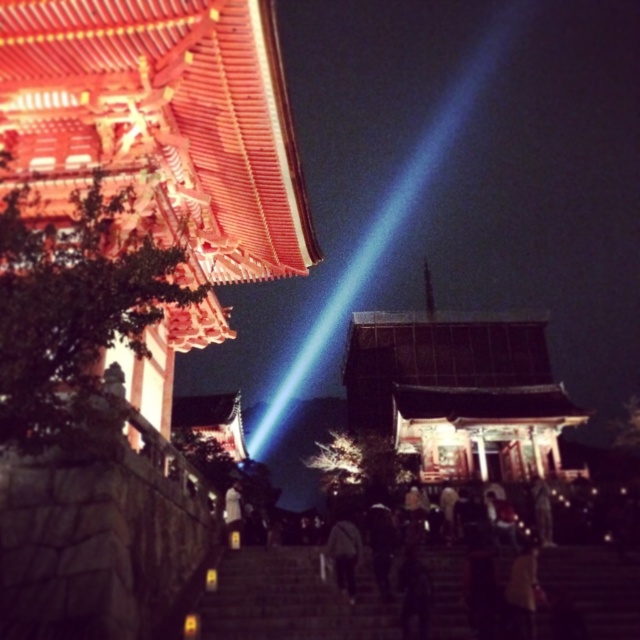
Question: Is dark stone stairs at center smaller than white matte person at center?

Choices:
 (A) no
 (B) yes

Answer: (B)

Question: Which object appears closest to the camera in this image?

Choices:
 (A) dark gray fabric jacket at center
 (B) dark stone stairs at center
 (C) white matte person at center

Answer: (B)

Question: Among these points, which one is nearest to the camera?

Choices:
 (A) (220, 600)
 (B) (234, 477)

Answer: (A)

Question: Is dark stone stairs at center positioned at the back of dark gray fabric jacket at center?

Choices:
 (A) yes
 (B) no

Answer: (B)

Question: Can you confirm if dark gray fabric jacket at center is positioned above white matte person at center?

Choices:
 (A) no
 (B) yes

Answer: (A)

Question: Which is nearer to the dark gray fabric jacket at center?

Choices:
 (A) dark stone stairs at center
 (B) white matte person at center

Answer: (A)